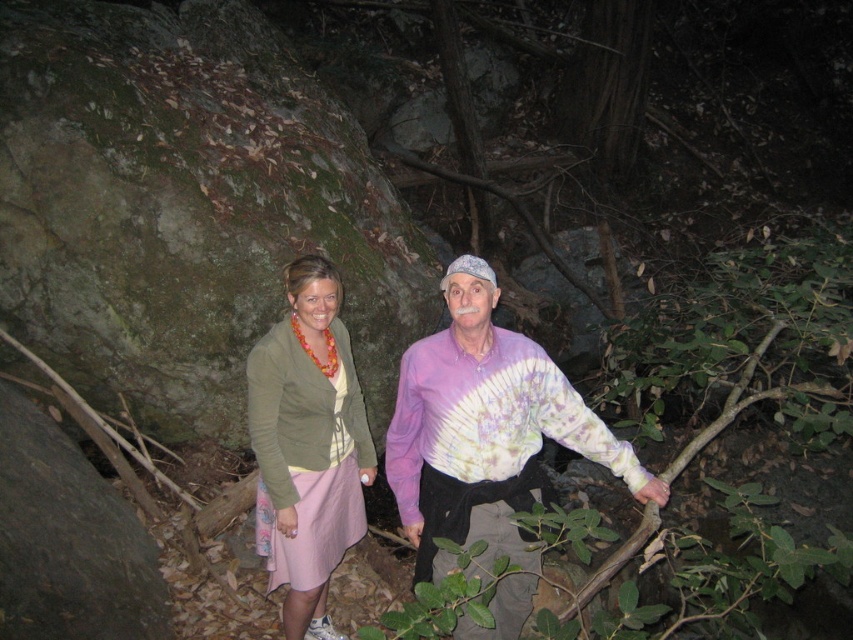
Question: Among these points, which one is farthest from the camera?

Choices:
 (A) (334, 298)
 (B) (409, 413)

Answer: (A)

Question: Is tie-dye fabric shirt at center above matte olive green cardigan at center?

Choices:
 (A) yes
 (B) no

Answer: (A)

Question: Which of the following is the closest to the observer?

Choices:
 (A) (410, 538)
 (B) (289, 352)

Answer: (B)

Question: Is tie-dye fabric shirt at center above matte olive green cardigan at center?

Choices:
 (A) yes
 (B) no

Answer: (A)

Question: Observing the image, what is the correct spatial positioning of tie-dye fabric shirt at center in reference to matte olive green cardigan at center?

Choices:
 (A) left
 (B) right

Answer: (B)